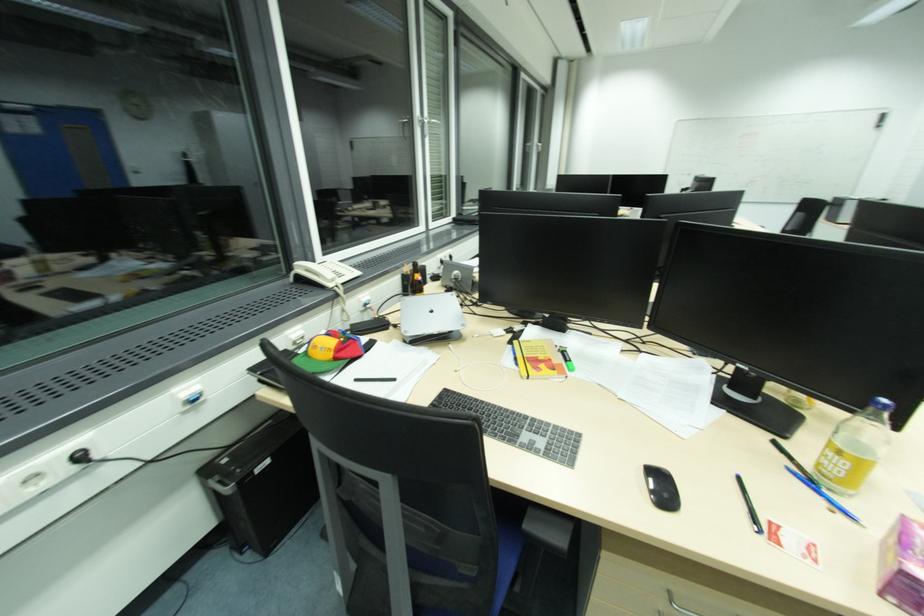
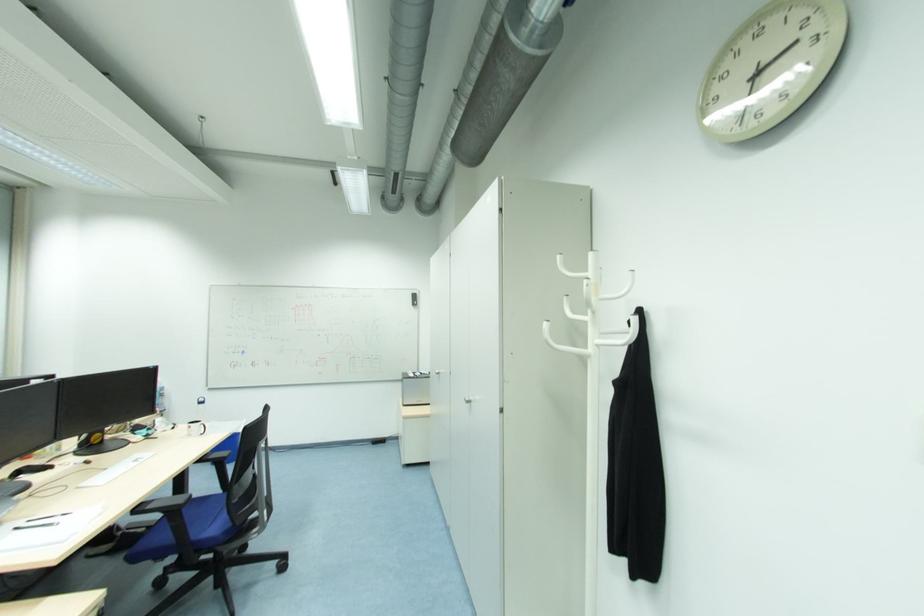
Locate, in the second image, the point that corresponds to the point at 882,118 in the first image.

(417, 298)